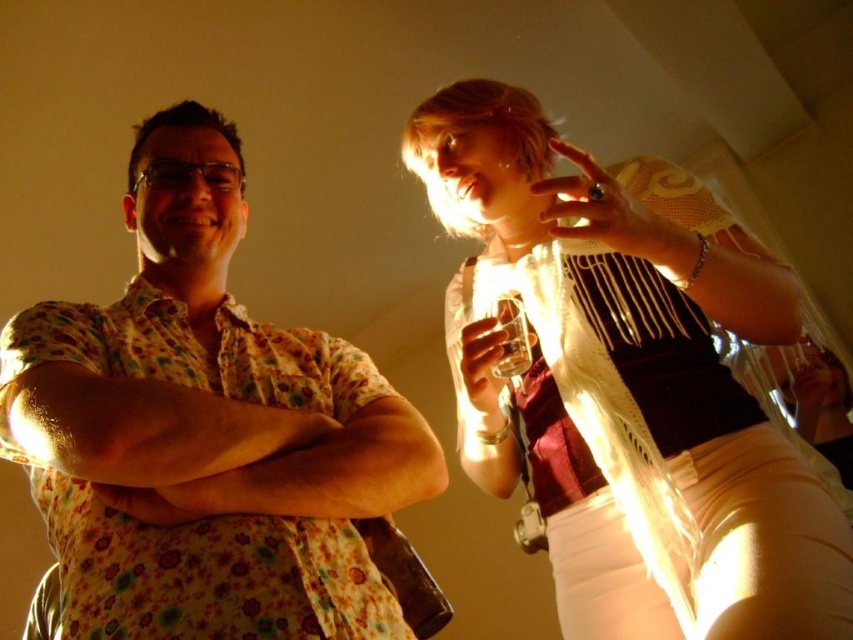
You are organizing a clothing donation drive and need to determine if the matte white scarf at upper right and the floral cotton shirt at left can fit into a standard donation box that measures 30cm x 30cm. Based on their sizes, can both items fit inside the box together?

The matte white scarf at upper right is larger in size than the floral cotton shirt at left. Since the scarf is bigger, it might take up more space, but both items could potentially fit into the 30cm x 30cm donation box if properly folded or arranged.

You are at a party and want to hang a small decoration between the matte white scarf at upper right and the floral cotton shirt at left. Which object should you hang the decoration closer to to ensure it is centered between them?

The decoration should be hung closer to the floral cotton shirt at left because the matte white scarf at upper right has a greater height, meaning it is positioned higher up than the floral cotton shirt at left.

You are at a social gathering and want to move from the person on the right to the person on the left. Based on the coordinates provided, will you pass through the area marked by point (727, 572) first or point (160, 384) first?

Since point (727, 572) is behind point (160, 384), you will pass through point (160, 384) first before reaching the area marked by point (727, 572).